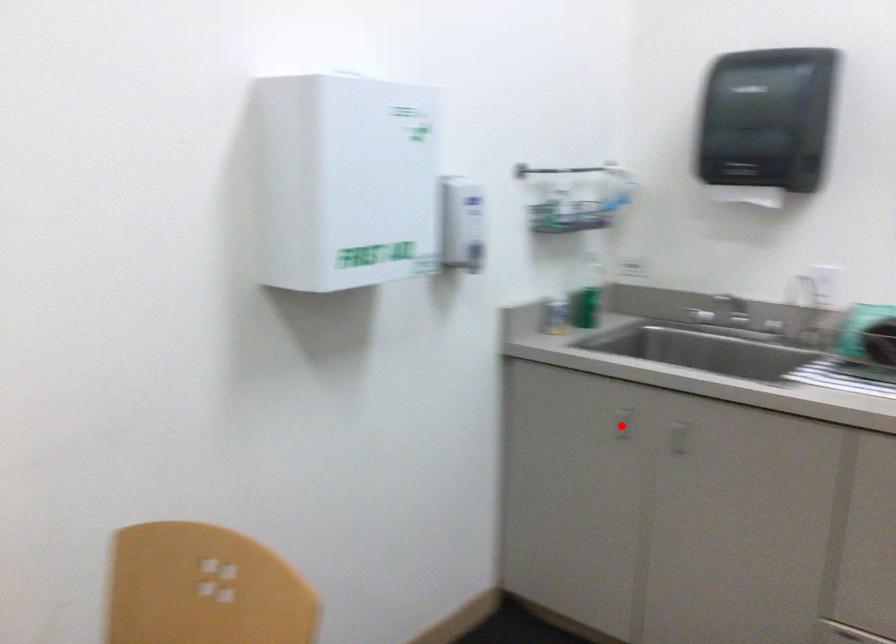
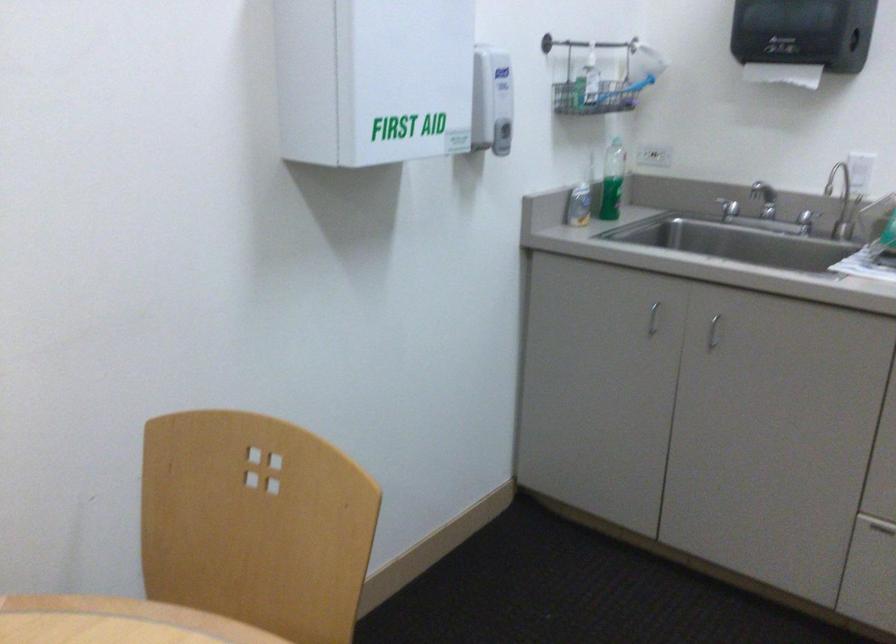
Question: I am providing you with two images of the same scene from different viewpoints. A red point is marked on the first image. Can you still see the location of the red point in image 2?

Choices:
 (A) Yes
 (B) No

Answer: (A)